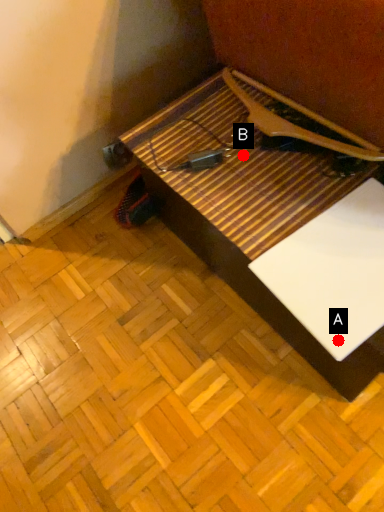
Question: Two points are circled on the image, labeled by A and B beside each circle. Which point appears closest to the camera in this image?

Choices:
 (A) A is closer
 (B) B is closer

Answer: (A)